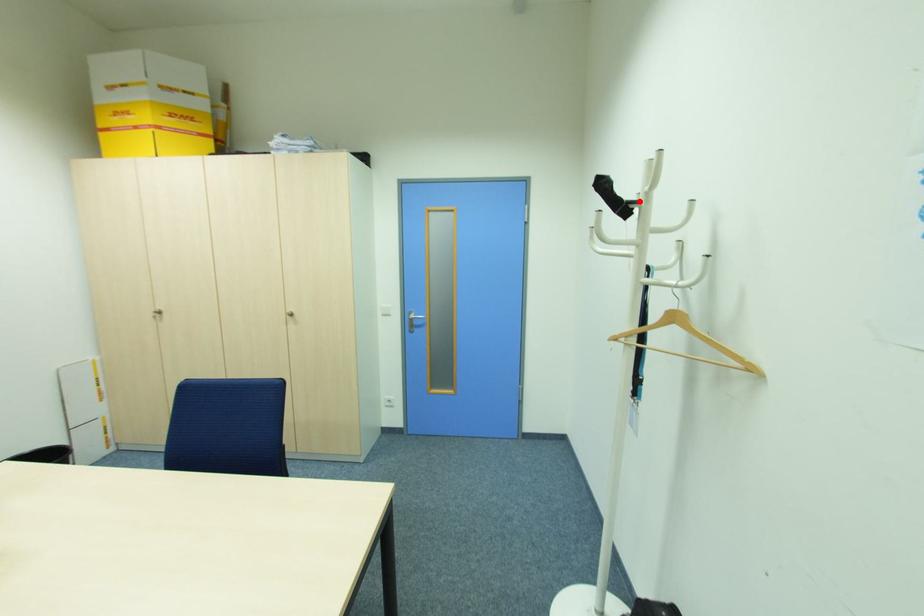
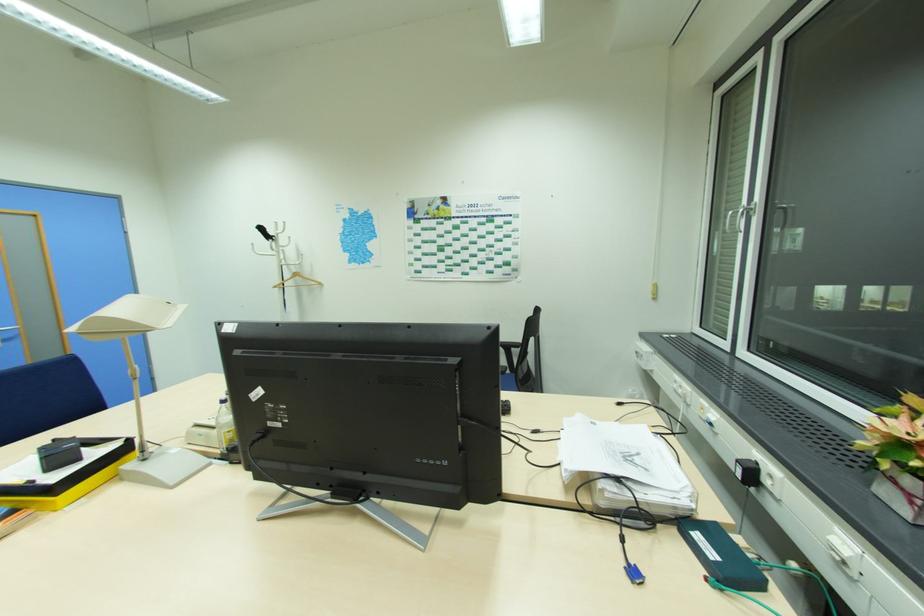
Locate, in the second image, the point that corresponds to the highlighted location in the first image.

(276, 237)